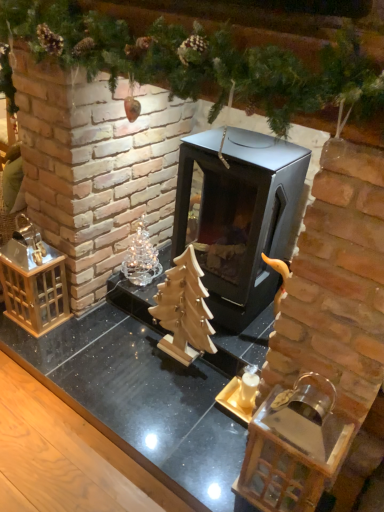
Identify the location of vacant area situated to the left side of wooden christmas tree at center. (126, 354).